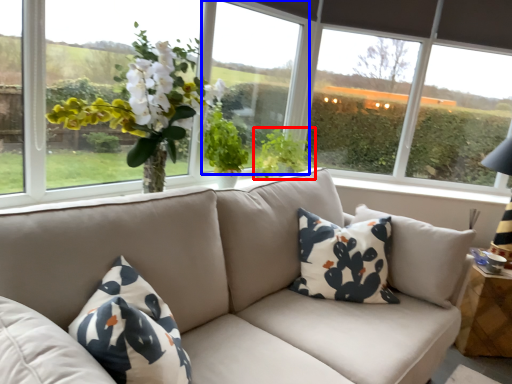
Question: Which of the following is the closest to the observer, plant (highlighted by a red box) or window screen (highlighted by a blue box)?

Choices:
 (A) plant
 (B) window screen

Answer: (B)